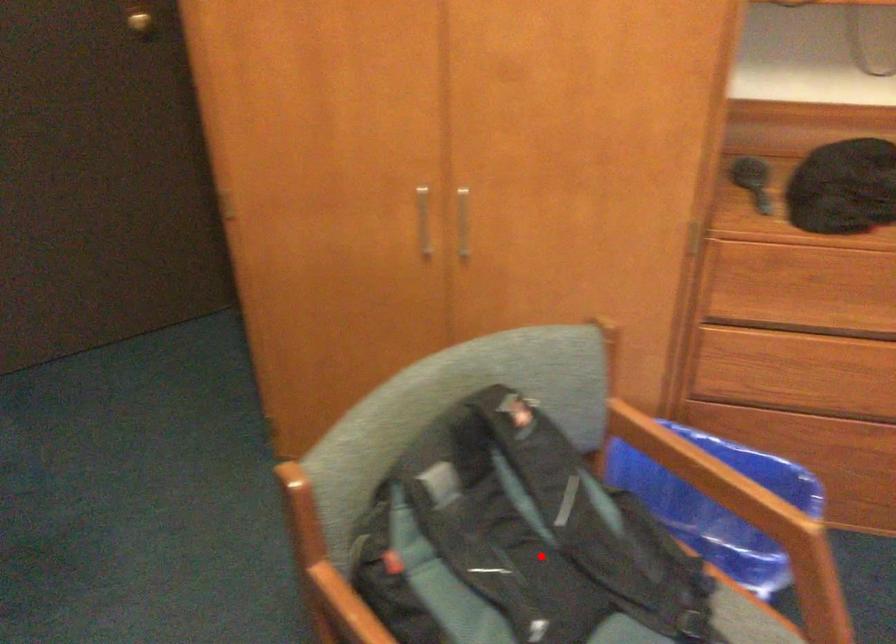
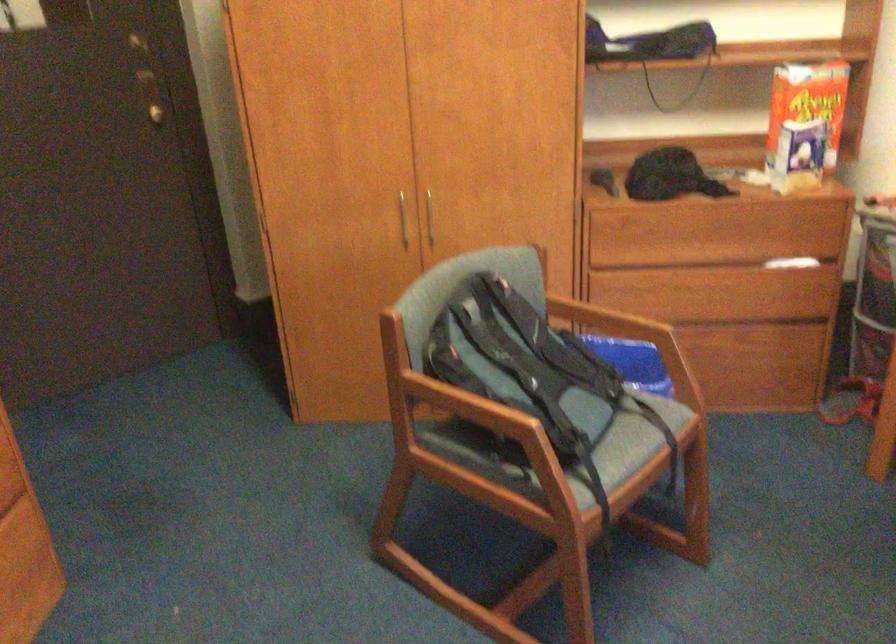
Find the pixel in the second image that matches the highlighted location in the first image.

(522, 364)